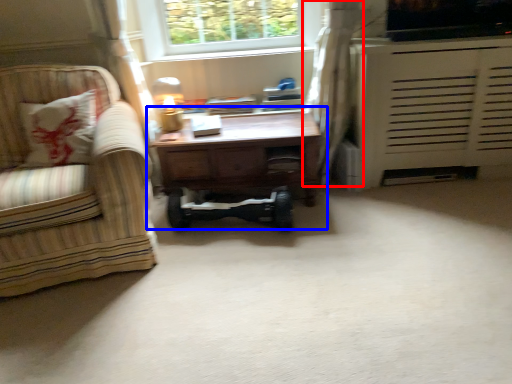
Question: Which object is closer to the camera taking this photo, curtain (highlighted by a red box) or table (highlighted by a blue box)?

Choices:
 (A) curtain
 (B) table

Answer: (A)